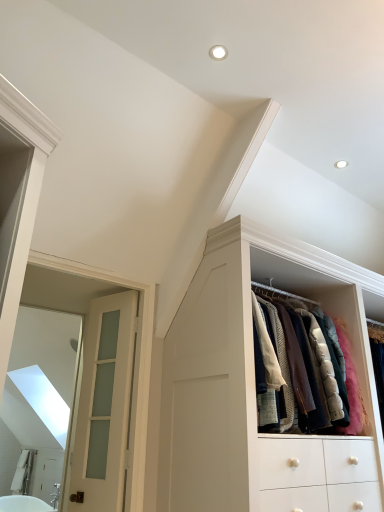
Question: Is white frosted glass door at left at the right side of white wood cabinet at upper right?

Choices:
 (A) no
 (B) yes

Answer: (A)

Question: Is white frosted glass door at left at the left side of white wood cabinet at upper right?

Choices:
 (A) yes
 (B) no

Answer: (A)

Question: Is white wood cabinet at upper right completely or partially inside white frosted glass door at left?

Choices:
 (A) yes
 (B) no

Answer: (B)

Question: Is white frosted glass door at left completely or partially outside of white wood cabinet at upper right?

Choices:
 (A) yes
 (B) no

Answer: (A)

Question: From the image's perspective, is white frosted glass door at left under white wood cabinet at upper right?

Choices:
 (A) yes
 (B) no

Answer: (A)

Question: Can you confirm if white frosted glass door at left is shorter than white wood cabinet at upper right?

Choices:
 (A) yes
 (B) no

Answer: (B)

Question: From the image's perspective, is white glossy bathtub at lower left located above white wood cabinet at upper right?

Choices:
 (A) yes
 (B) no

Answer: (B)

Question: From a real-world perspective, is white glossy bathtub at lower left on white wood cabinet at upper right?

Choices:
 (A) yes
 (B) no

Answer: (B)

Question: Could you tell me if white glossy bathtub at lower left is facing white wood cabinet at upper right?

Choices:
 (A) no
 (B) yes

Answer: (A)

Question: Is white glossy bathtub at lower left bigger than white wood cabinet at upper right?

Choices:
 (A) no
 (B) yes

Answer: (A)

Question: Can we say white glossy bathtub at lower left lies outside white wood cabinet at upper right?

Choices:
 (A) yes
 (B) no

Answer: (A)

Question: From a real-world perspective, is white glossy bathtub at lower left beneath white wood cabinet at upper right?

Choices:
 (A) no
 (B) yes

Answer: (B)

Question: From the image's perspective, does white frosted glass door at left appear higher than white glossy bathtub at lower left?

Choices:
 (A) no
 (B) yes

Answer: (B)